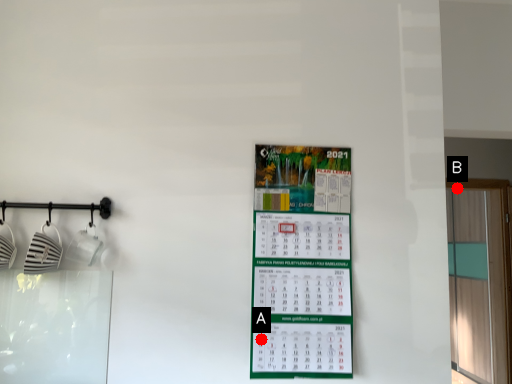
Question: Two points are circled on the image, labeled by A and B beside each circle. Which point is closer to the camera taking this photo?

Choices:
 (A) A is closer
 (B) B is closer

Answer: (A)